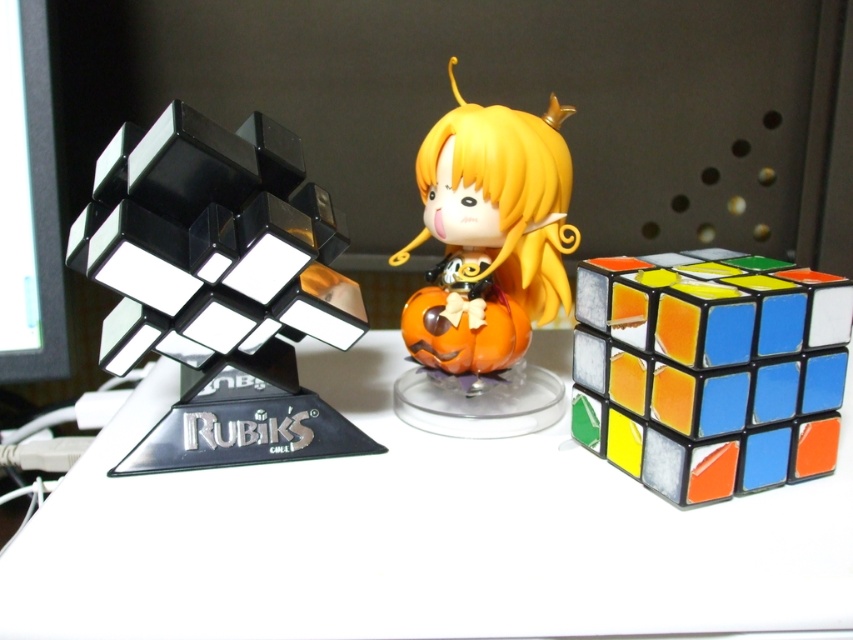
Who is more distant from viewer, (715,563) or (634,272)?

Positioned behind is point (634,272).

Which is behind, point (190, 611) or point (840, 352)?

The point (840, 352) is more distant.

Locate an element on the screen. white glossy table at center is located at coordinates (416, 536).

Between white glossy table at center and orange matte pumpkin at center, which one appears on the right side from the viewer's perspective?

From the viewer's perspective, white glossy table at center appears more on the right side.

Which is behind, point (369, 548) or point (479, 358)?

Positioned behind is point (479, 358).

Between point (628, 593) and point (415, 337), which one is positioned behind?

Point (415, 337)

This screenshot has width=853, height=640. Identify the location of white glossy table at center. (416, 536).

Can you confirm if transparent plastic rubik's cube at left is bigger than orange matte pumpkin at center?

Correct, transparent plastic rubik's cube at left is larger in size than orange matte pumpkin at center.

Looking at this image, between transparent plastic rubik's cube at left and orange matte pumpkin at center, which one has more height?

Standing taller between the two is transparent plastic rubik's cube at left.

Is point (177, 163) positioned behind point (456, 364)?

No, (177, 163) is closer to viewer.

This screenshot has width=853, height=640. Identify the location of transparent plastic rubik's cube at left. (227, 292).